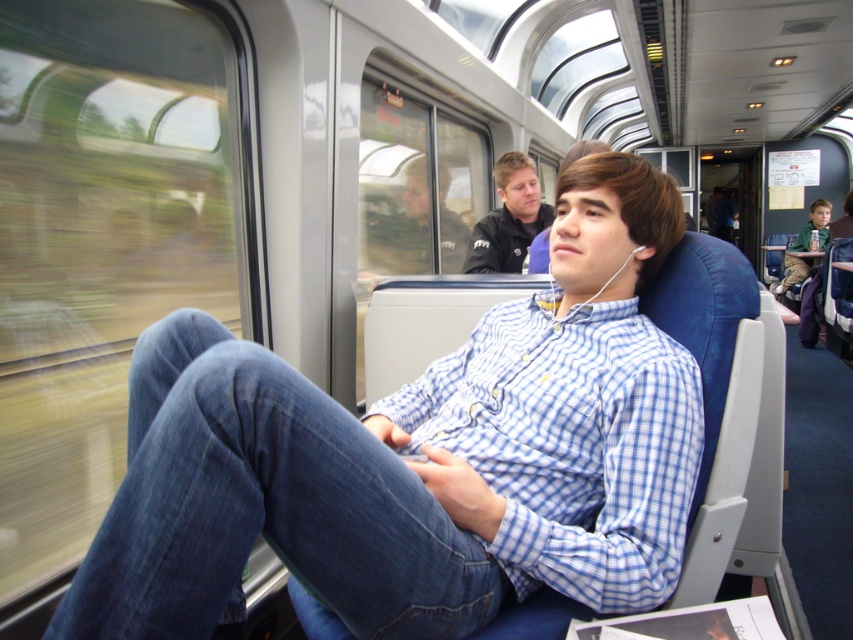
From the picture: You are a passenger on the train and want to place your bag between the denim at left and the matte black jacket at center. Is there enough space between them to fit your bag?

The denim at left is to the left of the matte black jacket at center, so there is space between them to place your bag.

You are a passenger sitting in the blue train seat. You notice two points marked in the scene. Which point is closer to you, point (450, 586) or point (482, 236)?

Point (450, 586) is closer to you than point (482, 236).

You are a passenger on the train and want to store your small bag temporarily. You see the denim at left and the dark blue jacket at upper center. Which object can accommodate your bag without taking up too much space?

The denim at left occupies less space than the dark blue jacket at upper center, so the denim at left can accommodate your bag without taking up too much space.